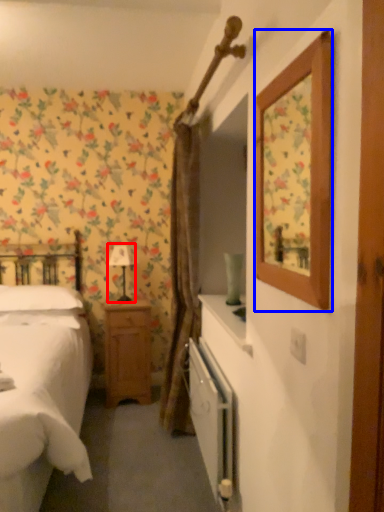
Question: Which object appears closest to the camera in this image, table lamp (highlighted by a red box) or picture frame (highlighted by a blue box)?

Choices:
 (A) table lamp
 (B) picture frame

Answer: (B)